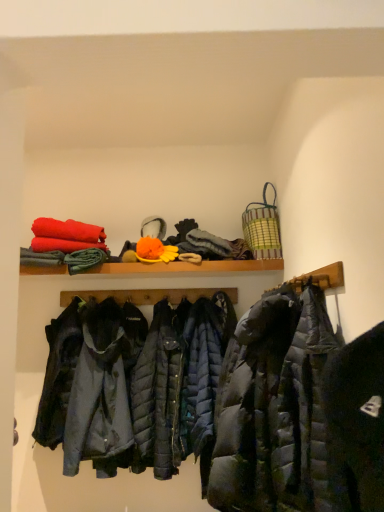
You are a GUI agent. You are given a task and a screenshot of the screen. Output one action in this format:
    pyautogui.click(x=<x>, y=<y>)
    Task: Click on the dark gray quilted jacket at center
    
    Given the screenshot: What is the action you would take?
    pyautogui.click(x=273, y=408)

Locate an element on the screen. This screenshot has width=384, height=512. dark gray quilted jacket at center is located at coordinates (273, 408).

Is green striped woven basket at upper right oriented towards dark gray quilted jacket at center?

No, green striped woven basket at upper right is not oriented towards dark gray quilted jacket at center.

I want to click on jacket below the green striped woven basket at upper right (from the image's perspective), so click(x=273, y=408).

Is green striped woven basket at upper right inside or outside of dark gray quilted jacket at center?

green striped woven basket at upper right is outside dark gray quilted jacket at center.

Between green striped woven basket at upper right and dark gray quilted jacket at center, which one appears on the right side from the viewer's perspective?

Positioned to the right is green striped woven basket at upper right.

Does wooden shelf at upper center have a smaller size compared to green striped woven basket at upper right?

No, wooden shelf at upper center is not smaller than green striped woven basket at upper right.

Considering the relative positions of wooden shelf at upper center and green striped woven basket at upper right in the image provided, is wooden shelf at upper center to the right of green striped woven basket at upper right from the viewer's perspective?

No, wooden shelf at upper center is not to the right of green striped woven basket at upper right.

Is wooden shelf at upper center not inside green striped woven basket at upper right?

Yes, wooden shelf at upper center is not within green striped woven basket at upper right.

Find the location of a particular element. The width and height of the screenshot is (384, 512). basket above the wooden shelf at upper center (from the image's perspective) is located at coordinates (262, 228).

You are a GUI agent. You are given a task and a screenshot of the screen. Output one action in this format:
    pyautogui.click(x=<x>, y=<y>)
    Task: Click on the shelf that is behind the green striped woven basket at upper right
    The height and width of the screenshot is (512, 384).
    Given the screenshot: What is the action you would take?
    pyautogui.click(x=188, y=267)

Choose the correct answer: Is green striped woven basket at upper right inside wooden shelf at upper center or outside it?

green striped woven basket at upper right lies outside wooden shelf at upper center.

Looking at their sizes, would you say green striped woven basket at upper right is wider or thinner than wooden shelf at upper center?

In the image, green striped woven basket at upper right appears to be more narrow than wooden shelf at upper center.

Is dark gray quilted jacket at center at the left side of wooden shelf at upper center?

No, dark gray quilted jacket at center is not to the left of wooden shelf at upper center.

Could you tell me if dark gray quilted jacket at center is turned towards wooden shelf at upper center?

No, dark gray quilted jacket at center is not turned towards wooden shelf at upper center.

From the picture: Who is taller, dark gray quilted jacket at center or wooden shelf at upper center?

With more height is dark gray quilted jacket at center.

Is dark gray quilted jacket at center oriented towards green striped woven basket at upper right?

No, dark gray quilted jacket at center does not turn towards green striped woven basket at upper right.

From a real-world perspective, which is physically below, dark gray quilted jacket at center or green striped woven basket at upper right?

dark gray quilted jacket at center, from a real-world perspective.

Is dark gray quilted jacket at center to the left of green striped woven basket at upper right from the viewer's perspective?

Yes.

In order to click on shelf behind the dark gray quilted jacket at center in this screenshot , I will do `click(188, 267)`.

Considering the relative sizes of wooden shelf at upper center and dark gray quilted jacket at center in the image provided, is wooden shelf at upper center bigger than dark gray quilted jacket at center?

Incorrect, wooden shelf at upper center is not larger than dark gray quilted jacket at center.

From the image's perspective, is wooden shelf at upper center above or below dark gray quilted jacket at center?

wooden shelf at upper center is above dark gray quilted jacket at center.

How different are the orientations of wooden shelf at upper center and dark gray quilted jacket at center in degrees?

They differ by 90.8 degrees in their facing directions.

Locate an element on the screen. basket behind the dark gray quilted jacket at center is located at coordinates (262, 228).

This screenshot has width=384, height=512. Identify the location of basket above the wooden shelf at upper center (from the image's perspective). (262, 228).

From the image, which object appears to be nearer to dark gray quilted jacket at center, wooden shelf at upper center or green striped woven basket at upper right?

Among the two, green striped woven basket at upper right is located nearer to dark gray quilted jacket at center.

Considering their positions, is green striped woven basket at upper right positioned closer to dark gray quilted jacket at center than wooden shelf at upper center?

green striped woven basket at upper right lies closer to dark gray quilted jacket at center than the other object.

Estimate the real-world distances between objects in this image. Which object is closer to wooden shelf at upper center, dark gray quilted jacket at center or green striped woven basket at upper right?

Based on the image, green striped woven basket at upper right appears to be nearer to wooden shelf at upper center.

Considering their positions, is green striped woven basket at upper right positioned further to wooden shelf at upper center than dark gray quilted jacket at center?

The object further to wooden shelf at upper center is dark gray quilted jacket at center.

Looking at the image, which one is located further to green striped woven basket at upper right, wooden shelf at upper center or dark gray quilted jacket at center?

The object further to green striped woven basket at upper right is dark gray quilted jacket at center.

Looking at the image, which one is located further to green striped woven basket at upper right, dark gray quilted jacket at center or wooden shelf at upper center?

dark gray quilted jacket at center is positioned further to the anchor green striped woven basket at upper right.

This screenshot has width=384, height=512. What are the coordinates of `basket between dark gray quilted jacket at center and wooden shelf at upper center along the z-axis` in the screenshot? It's located at (262, 228).